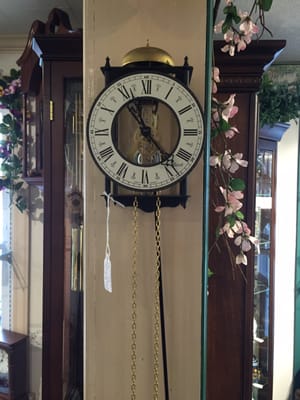
Where is `hinge`? The width and height of the screenshot is (300, 400). hinge is located at coordinates (55, 113).